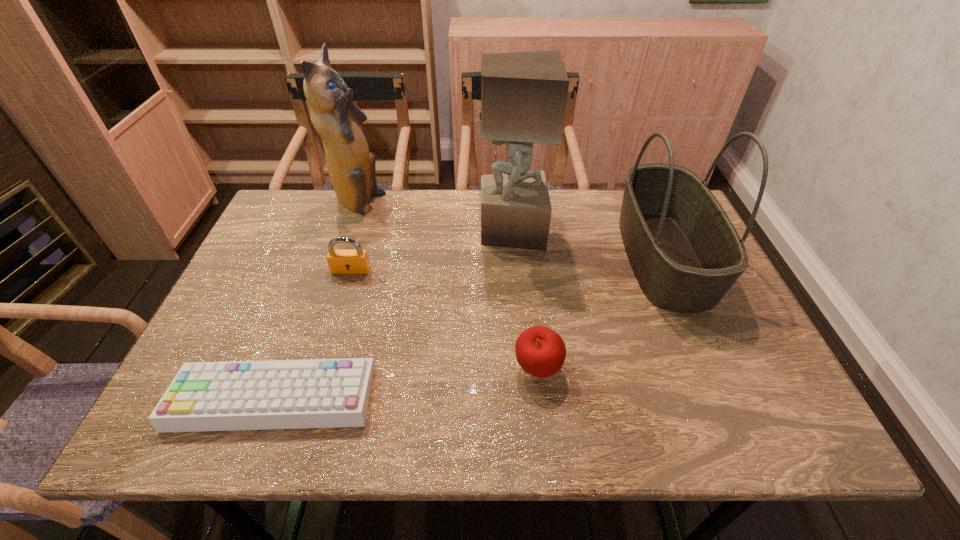
Locate an element on the screen. vacant region that satisfies the following two spatial constraints: 1. on the back side of the basket; 2. on the front-facing side of the sculpture is located at coordinates (652, 230).

Image resolution: width=960 pixels, height=540 pixels. I want to click on blank space that satisfies the following two spatial constraints: 1. on the front-facing side of the third tallest object; 2. on the right side of the sculpture, so click(x=513, y=256).

Where is `free space that satisfies the following two spatial constraints: 1. to unlock the apple from the front; 2. on the right side of the padlock`? This screenshot has height=540, width=960. free space that satisfies the following two spatial constraints: 1. to unlock the apple from the front; 2. on the right side of the padlock is located at coordinates (322, 369).

The width and height of the screenshot is (960, 540). I want to click on vacant space that satisfies the following two spatial constraints: 1. on the front-facing side of the sculpture; 2. on the left side of the apple, so click(x=521, y=369).